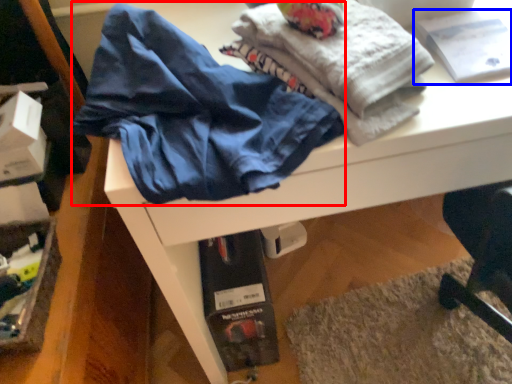
Question: Which point is closer to the camera, clothing (highlighted by a red box) or book (highlighted by a blue box)?

Choices:
 (A) clothing
 (B) book

Answer: (A)